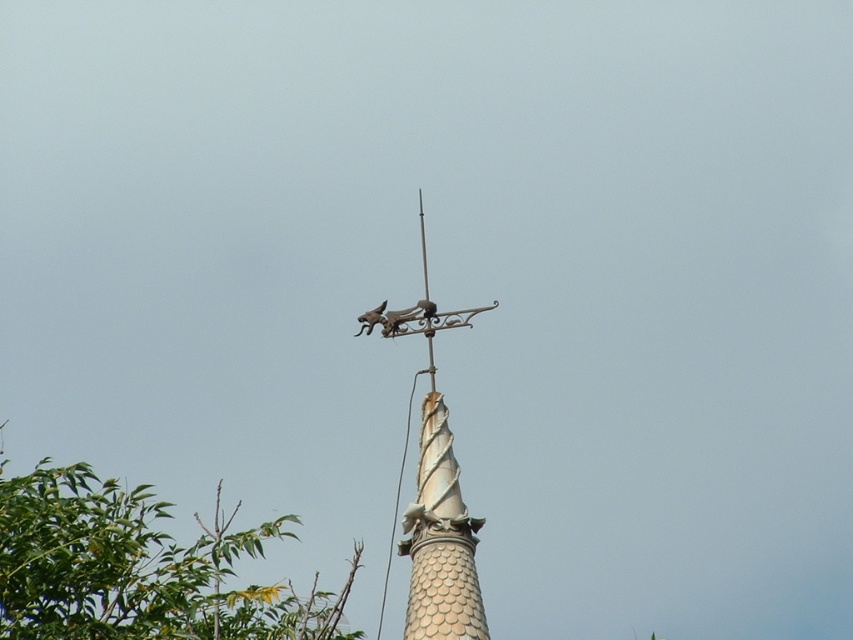
Question: Which of the following is the farthest from the observer?

Choices:
 (A) (422, 436)
 (B) (383, 324)
 (C) (122, 522)

Answer: (B)

Question: Does green leafy tree at upper left appear under metallic weather vane at center?

Choices:
 (A) no
 (B) yes

Answer: (A)

Question: Considering the real-world distances, which object is farthest from the metallic gray bird at top?

Choices:
 (A) green leafy tree at upper left
 (B) metallic weather vane at center

Answer: (A)

Question: Among these objects, which one is nearest to the camera?

Choices:
 (A) metallic gray bird at top
 (B) green leafy tree at upper left

Answer: (B)

Question: Is metallic weather vane at center above metallic gray bird at top?

Choices:
 (A) yes
 (B) no

Answer: (B)

Question: Observing the image, what is the correct spatial positioning of green leafy tree at upper left in reference to metallic gray bird at top?

Choices:
 (A) above
 (B) below

Answer: (B)